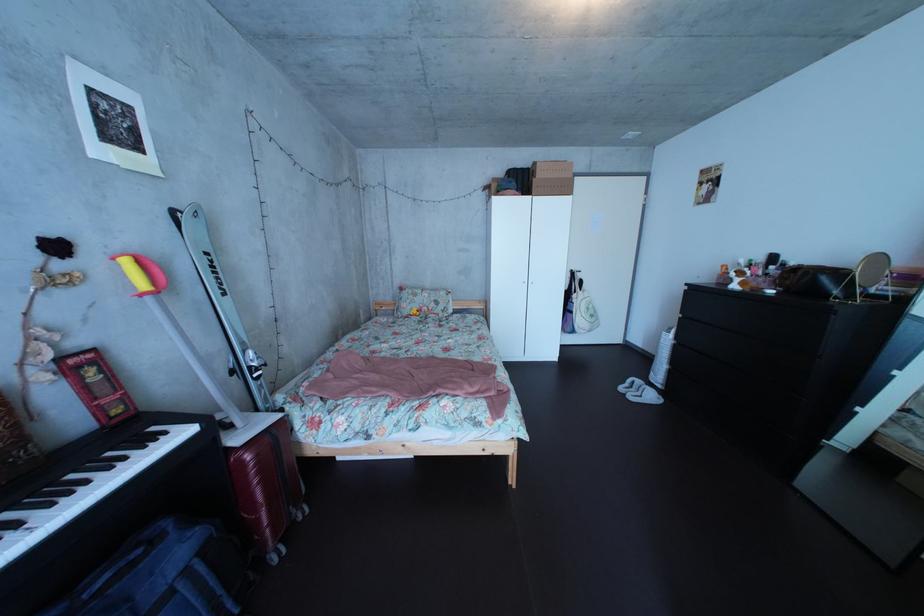
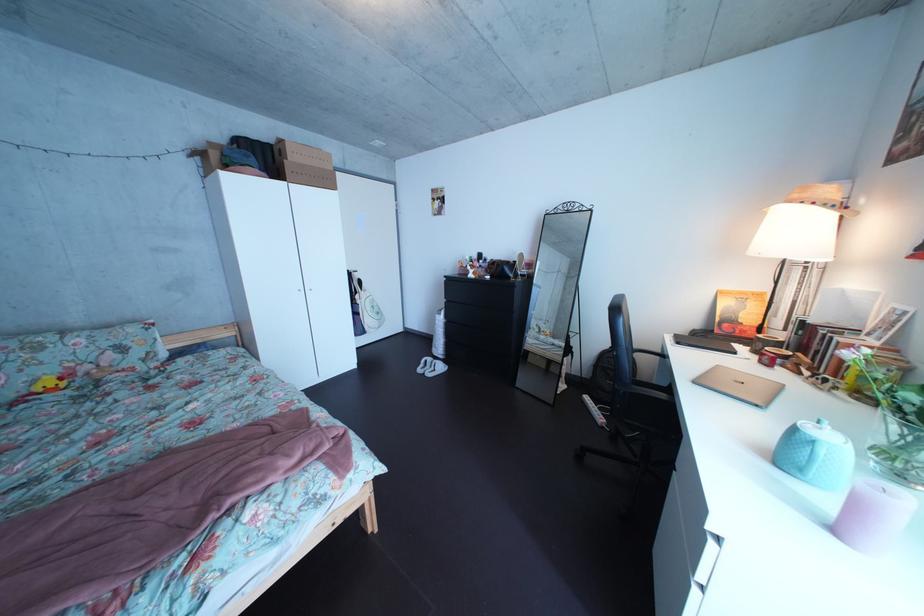
Question: The camera is either moving clockwise (left) or counter-clockwise (right) around the object. The first image is from the beginning of the video and the second image is from the end. Is the camera moving left or right when shooting the video?

Choices:
 (A) Left
 (B) Right

Answer: (A)